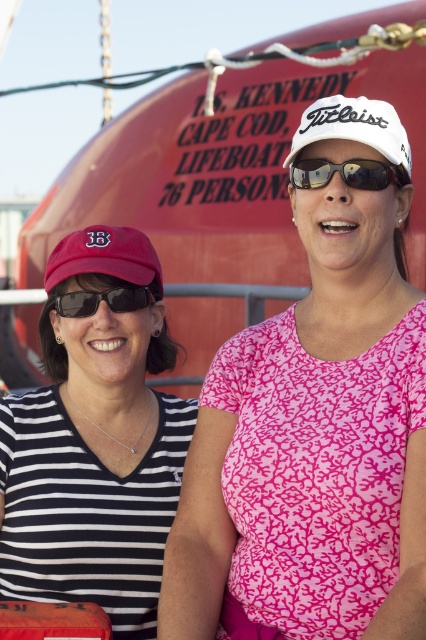
Is black striped shirt at upper left closer to camera compared to matte black sunglasses at center?

No, it is not.

Can you confirm if black striped shirt at upper left is taller than matte black sunglasses at center?

Yes, black striped shirt at upper left is taller than matte black sunglasses at center.

The image size is (426, 640). What are the coordinates of `black striped shirt at upper left` in the screenshot? It's located at (94, 442).

In the scene shown: Who is more distant from viewer, (287,422) or (299,132)?

Point (299,132)

Can you confirm if pink printed shirt at center is shorter than white matte baseball cap at upper center?

Yes, pink printed shirt at center is shorter than white matte baseball cap at upper center.

Is point (328, 280) closer to camera compared to point (336, 100)?

No, it is behind (336, 100).

At what (x,y) coordinates should I click in order to perform the action: click on pink printed shirt at center. Please return your answer as a coordinate pair (x, y). Looking at the image, I should click on (314, 428).

Can you confirm if matte red baseball cap at left is bigger than white matte baseball cap at upper center?

Incorrect, matte red baseball cap at left is not larger than white matte baseball cap at upper center.

Which is below, matte red baseball cap at left or white matte baseball cap at upper center?

matte red baseball cap at left is lower down.

Which is behind, point (100, 252) or point (319, 132)?

Positioned behind is point (100, 252).

Locate an element on the screen. Image resolution: width=426 pixels, height=640 pixels. matte red baseball cap at left is located at coordinates (106, 257).